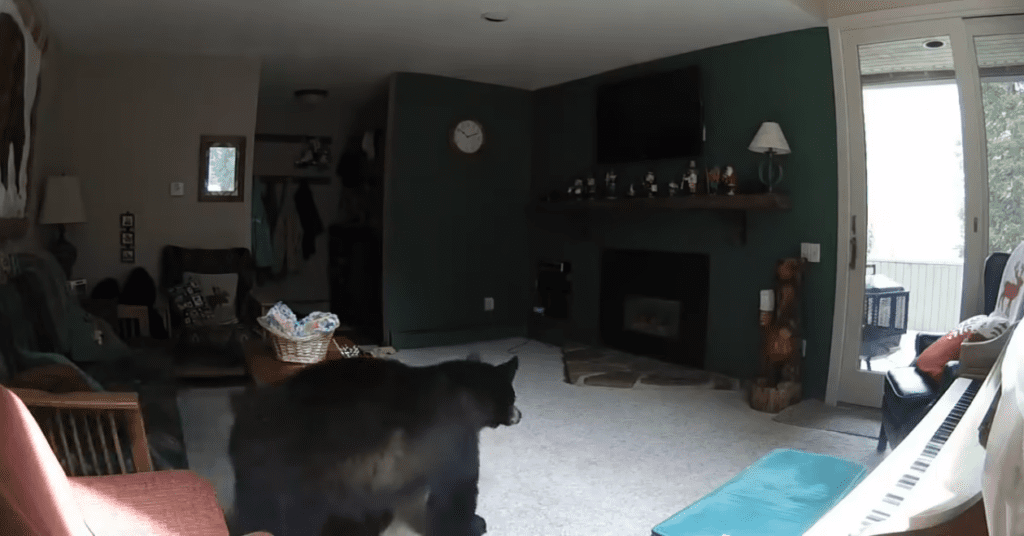
Identify the location of wall clock. The height and width of the screenshot is (536, 1024). (465, 140).